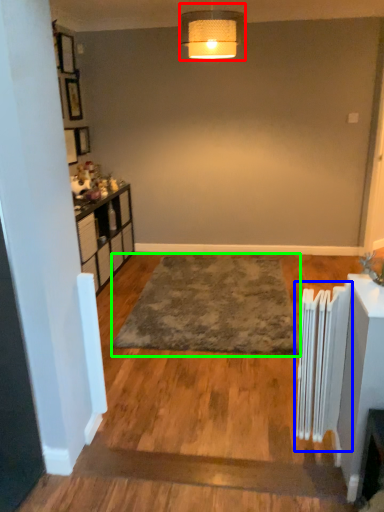
Question: Which object is the farthest from lamp (highlighted by a red box)? Choose among these: radiator (highlighted by a blue box) or mat (highlighted by a green box).

Choices:
 (A) radiator
 (B) mat

Answer: (A)